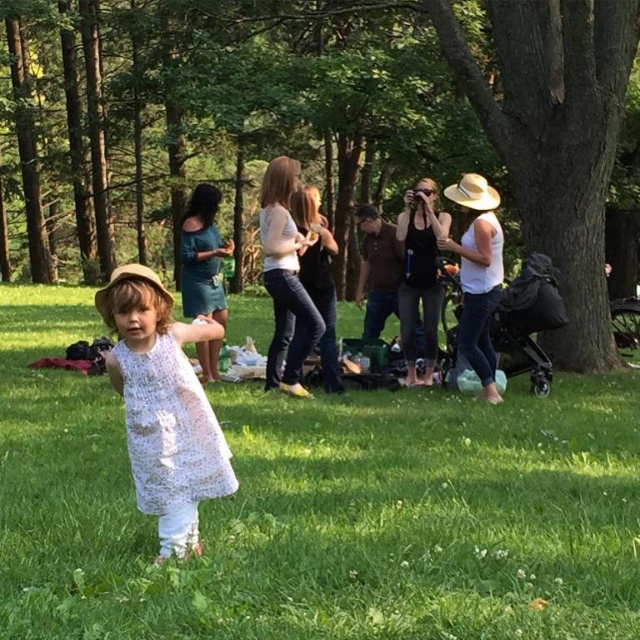
Is white matte tank top at center-right above black tank top at center?

Actually, white matte tank top at center-right is below black tank top at center.

Does white matte tank top at center-right lie in front of black tank top at center?

Yes, it is.

The image size is (640, 640). Describe the element at coordinates (477, 275) in the screenshot. I see `white matte tank top at center-right` at that location.

At what (x,y) coordinates should I click in order to perform the action: click on white matte tank top at center-right. Please return your answer as a coordinate pair (x, y). Looking at the image, I should click on (477, 275).

Can you confirm if white lace dress at center is positioned above black tank top at center?

Actually, white lace dress at center is below black tank top at center.

At what (x,y) coordinates should I click in order to perform the action: click on white lace dress at center. Please return your answer as a coordinate pair (x, y). This screenshot has height=640, width=640. Looking at the image, I should click on (170, 429).

Who is more distant from viewer, (211,449) or (483,348)?

Point (483,348)

Consider the image. Who is positioned more to the left, white lace dress at center or white matte tank top at center-right?

white lace dress at center

Which is in front, point (161, 435) or point (460, 257)?

Point (161, 435) is more forward.

You are a GUI agent. You are given a task and a screenshot of the screen. Output one action in this format:
    pyautogui.click(x=<x>, y=<y>)
    Task: Click on the white lace dress at center
    Image resolution: width=640 pixels, height=640 pixels.
    Given the screenshot: What is the action you would take?
    pyautogui.click(x=170, y=429)